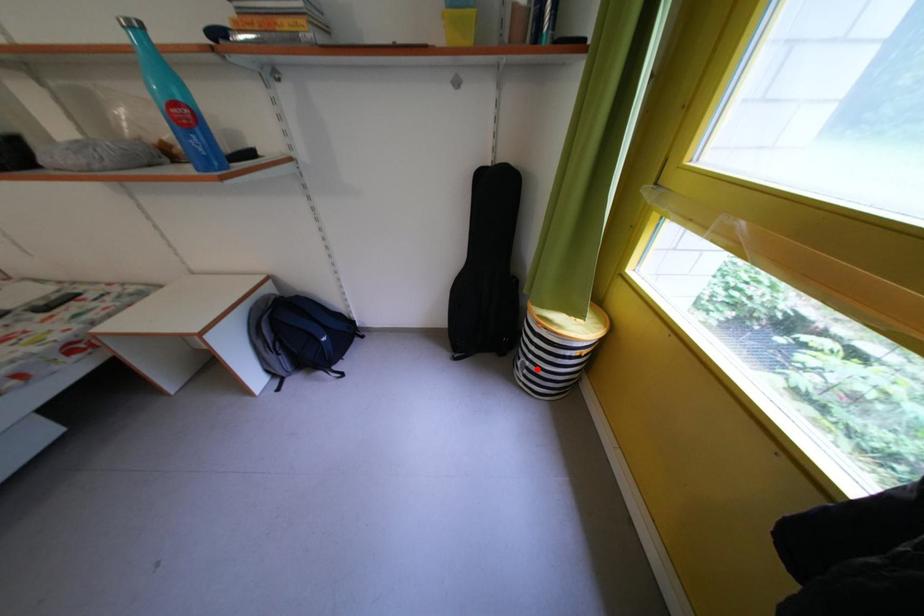
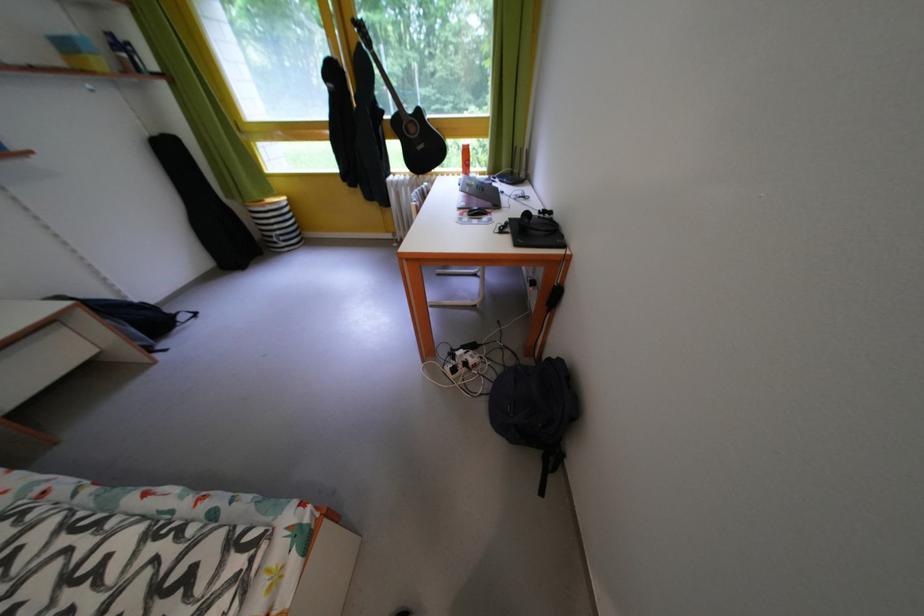
In the second image, find the point that corresponds to the highlighted location in the first image.

(287, 238)